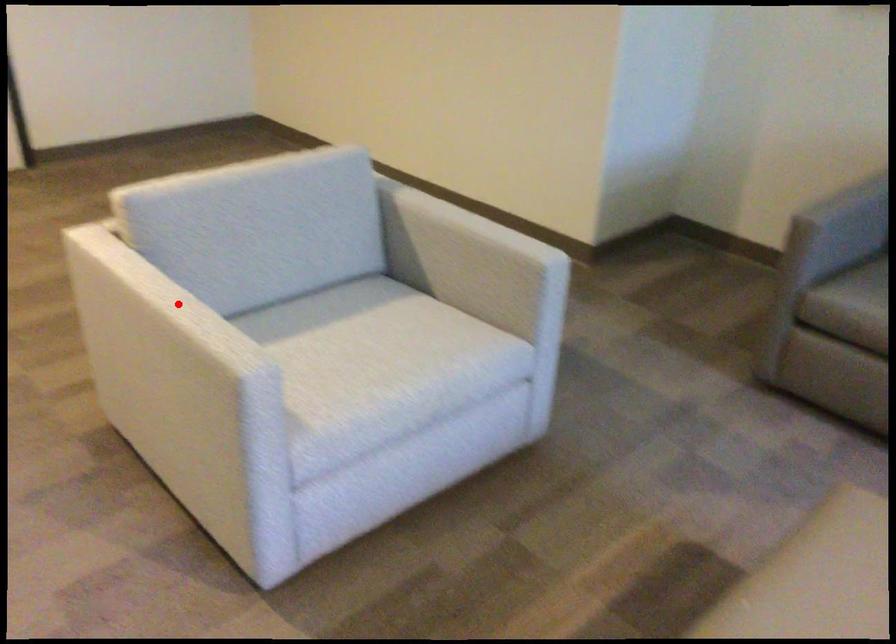
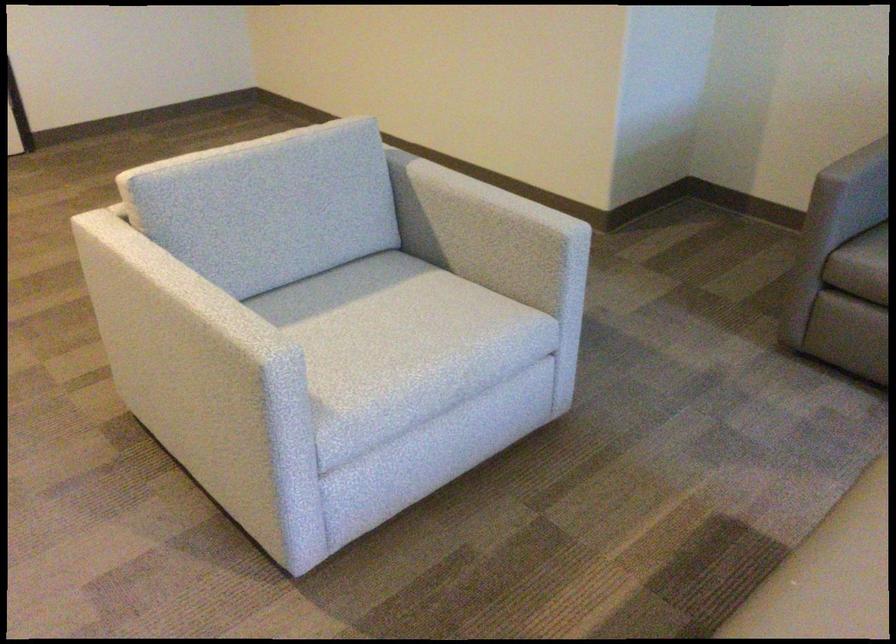
In the second image, find the point that corresponds to the highlighted location in the first image.

(195, 294)